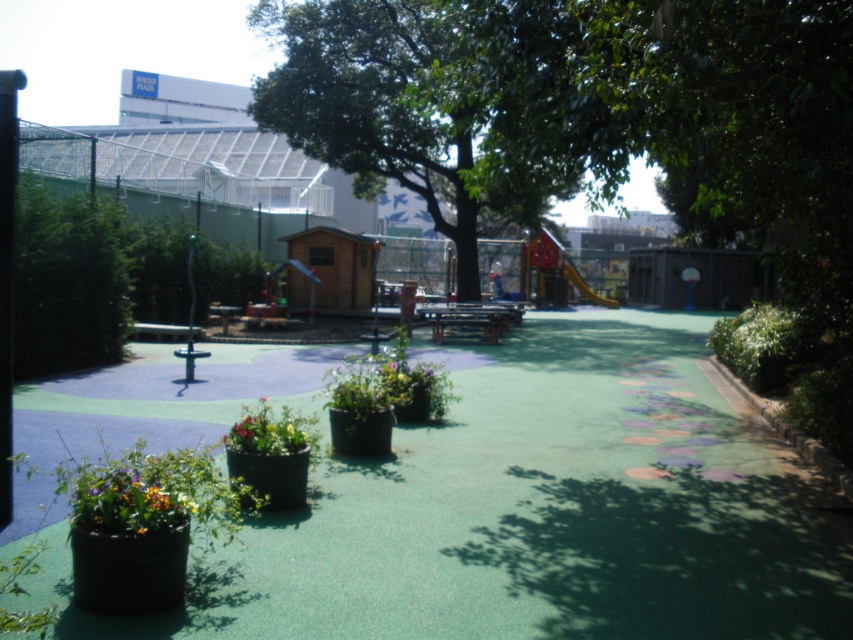
You are a gardener checking the playground. You notice the glossy ceramic flower pot at lower left and the multicolored plastic flowers at center. Which object is shorter?

The glossy ceramic flower pot at lower left is shorter than the multicolored plastic flowers at center.

You are a child playing in the playground and you see the glossy ceramic flower pot at lower left and the multicolored plastic flowers at center. Which one is closer to the wooden playhouse on the left side?

The glossy ceramic flower pot at lower left is closer to the wooden playhouse on the left side because it is positioned to the left of the multicolored plastic flowers at center.

From the picture: You are standing at the entrance of the playground and want to water the glossy ceramic flower pot at lower left. If your watering can has a maximum range of 3 meters, can you reach it without moving closer?

The glossy ceramic flower pot at lower left is 3.87 meters away from the viewer. Since the watering can has a maximum range of 3 meters, you cannot reach it without moving closer.